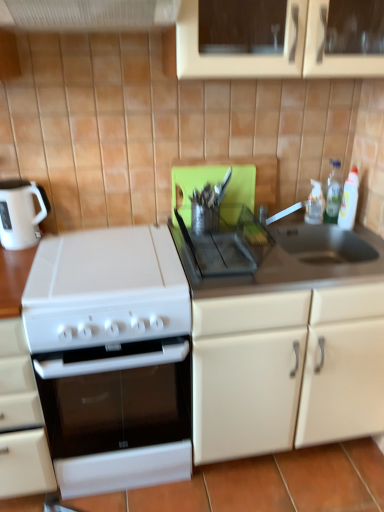
The image size is (384, 512). What are the coordinates of `vacant space underneath white glossy electric kettle at left (from a real-world perspective)` in the screenshot? It's located at (34, 240).